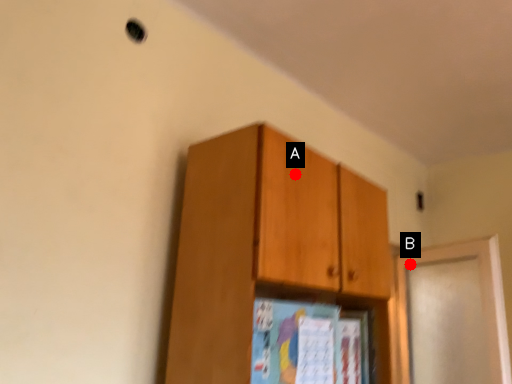
Question: Two points are circled on the image, labeled by A and B beside each circle. Which point is further to the camera?

Choices:
 (A) A is further
 (B) B is further

Answer: (B)